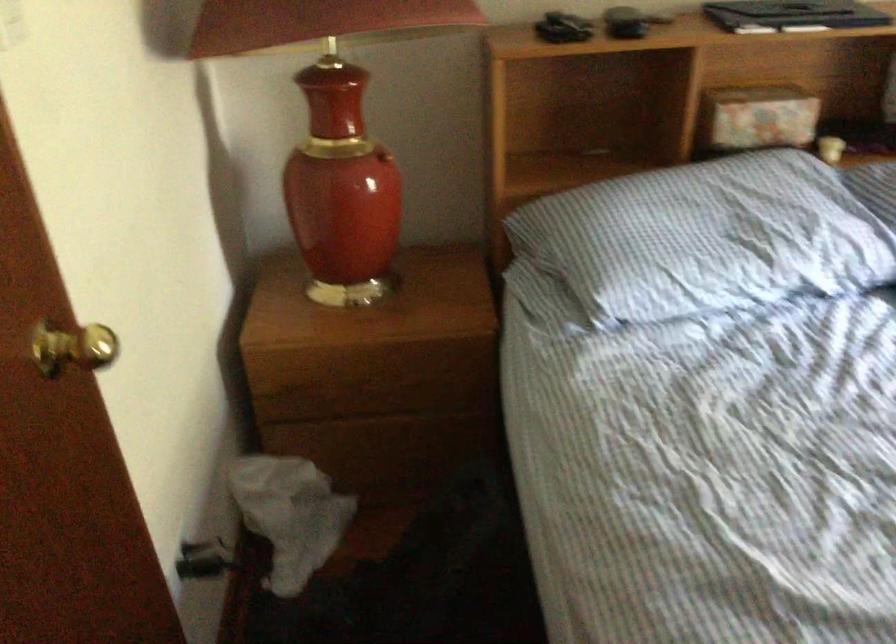
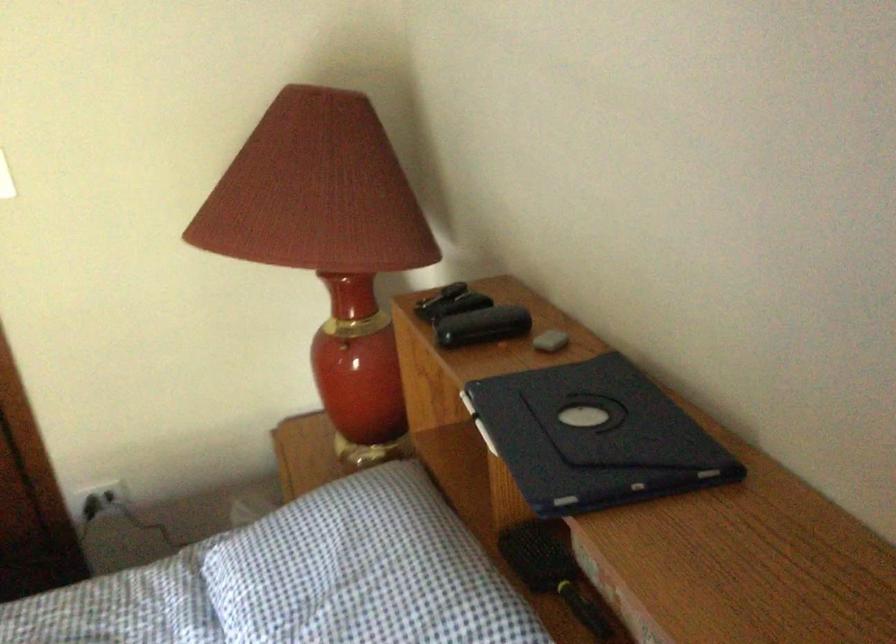
Question: I am providing you with two images of the same scene from different viewpoints. After the viewpoint changes to image2, which objects are now occluded?

Choices:
 (A) floral pattern box
 (B) blue circular object
 (C) wall outlet
 (D) black hairbrush

Answer: (A)